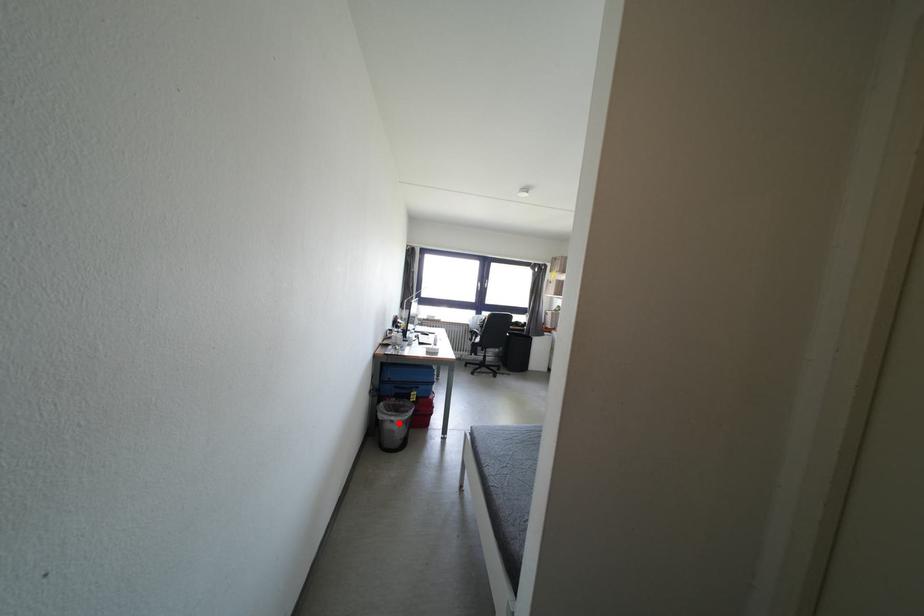
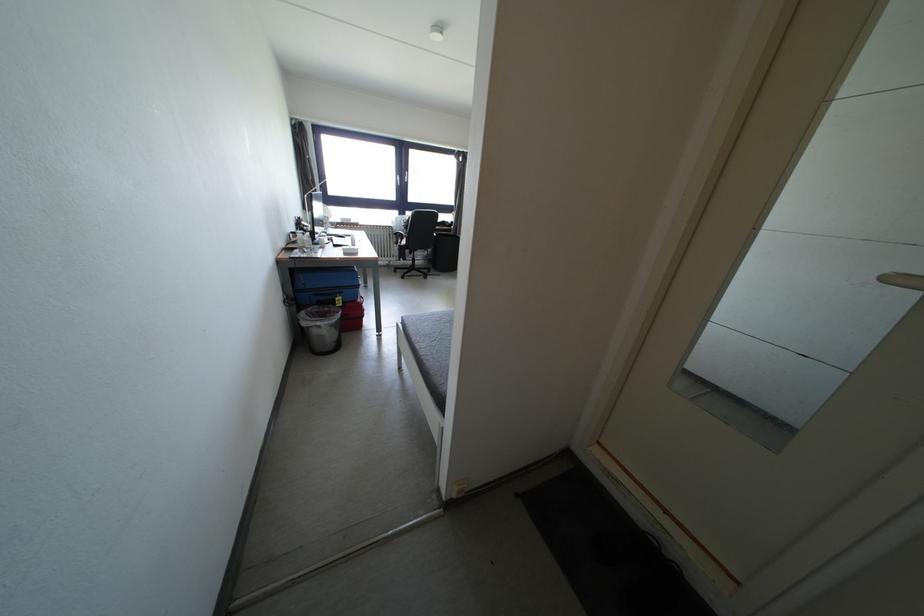
Question: I am providing you with two images of the same scene from different viewpoints. A red point is shown in image1. For the corresponding object point in image2, is it positioned nearer or farther from the camera?

Choices:
 (A) Nearer
 (B) Farther

Answer: (A)